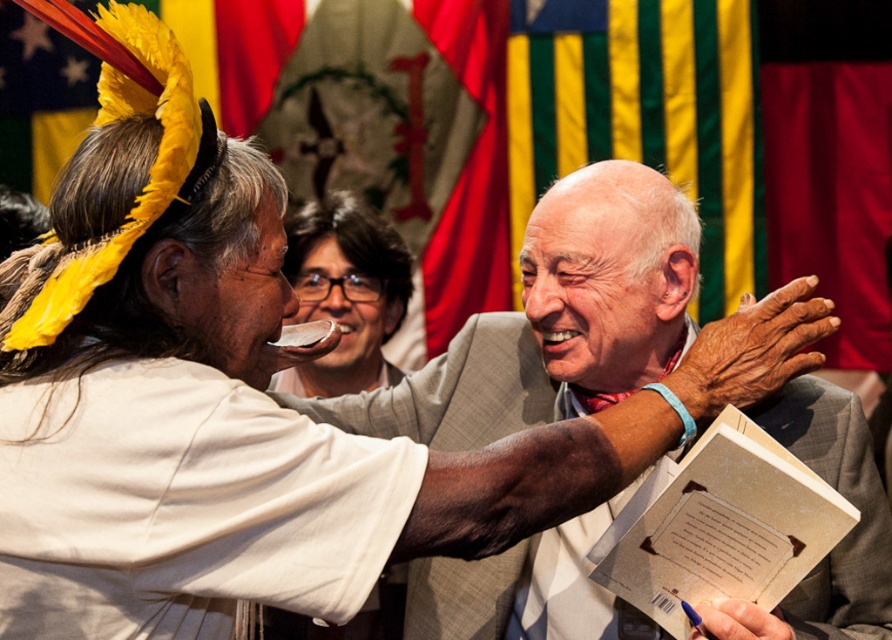
You are a photographer at the event and want to capture a clear shot of both the silky fabric flag at upper center and the matte black glasses at center. Which object will appear larger in the photo?

The silky fabric flag at upper center will appear larger in the photo because it is closer to the viewer than the matte black glasses at center.

You are a photographer at the event and need to capture a closeup of both the light gray suit at center and the matte black glasses at center. Can you fit them both in the frame if your camera has a 120cm wide lens?

The light gray suit at center is positioned on the right side of matte black glasses at center. Since the objects are positioned side by side, the total width required would depend on their individual sizes and the distance between them. However, without specific measurements of their sizes or the distance between them, it is impossible to determine if they can both fit within a 120cm wide lens. The question does not provide enough information to answer definitively.

You are a photographer at the event and need to capture a photo where both the light gray suit at center and the beige paper book at lower right are clearly visible. Given their height difference, where should you position your camera to ensure both are in frame?

The light gray suit at center is much taller than the beige paper book at lower right. To capture both clearly, position the camera at a lower angle so that the taller suit doesn t block the view of the shorter book.